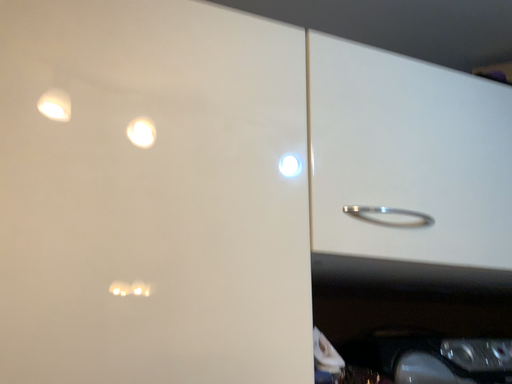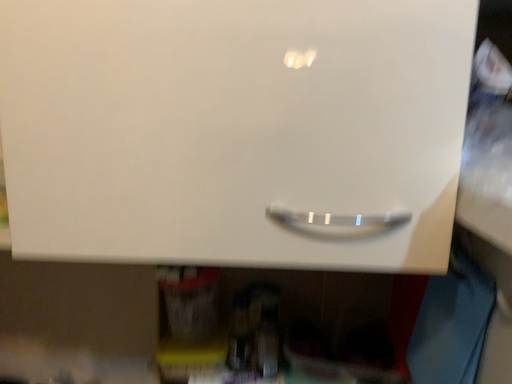
Question: How did the camera likely rotate when shooting the video?

Choices:
 (A) rotated upward
 (B) rotated downward

Answer: (B)